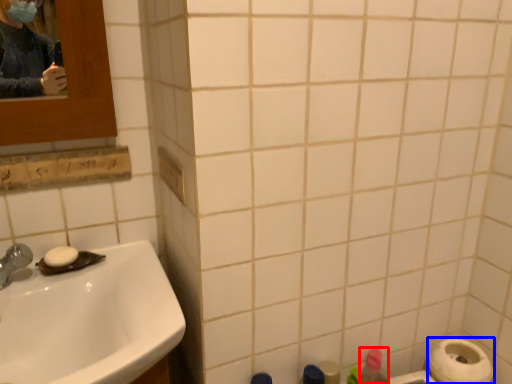
Question: Among these objects, which one is nearest to the camera, cleaning product (highlighted by a red box) or toilet paper (highlighted by a blue box)?

Choices:
 (A) cleaning product
 (B) toilet paper

Answer: (B)